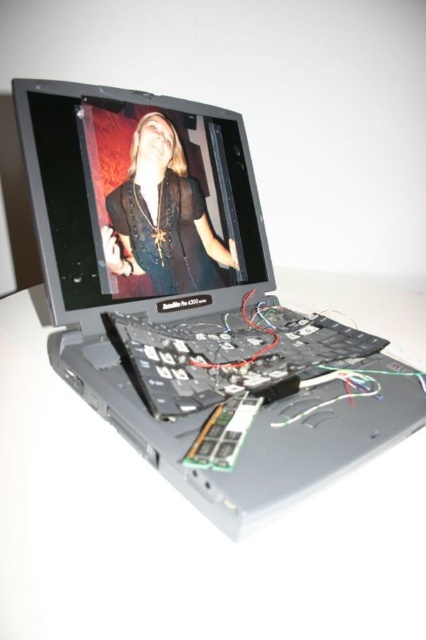
Is point (121, 92) positioned after point (198, 371)?

Yes, point (121, 92) is behind point (198, 371).

In order to click on satin black laptop at center in this screenshot , I will do `click(192, 305)`.

Identify the location of satin black laptop at center. (192, 305).

Which is more to the right, satin black laptop at center or matte black screen at center?

satin black laptop at center

Which of these two, satin black laptop at center or matte black screen at center, stands taller?

satin black laptop at center

The image size is (426, 640). Describe the element at coordinates (192, 305) in the screenshot. I see `satin black laptop at center` at that location.

At what (x,y) coordinates should I click in order to perform the action: click on satin black laptop at center. Please return your answer as a coordinate pair (x, y). Looking at the image, I should click on (192, 305).

Is satin black laptop at center smaller than matte black shirt at center?

Actually, satin black laptop at center might be larger than matte black shirt at center.

Is satin black laptop at center behind matte black shirt at center?

No, it is in front of matte black shirt at center.

Between point (88, 186) and point (115, 216), which one is positioned in front?

Positioned in front is point (88, 186).

Find the location of a particular element. This screenshot has width=426, height=640. satin black laptop at center is located at coordinates (192, 305).